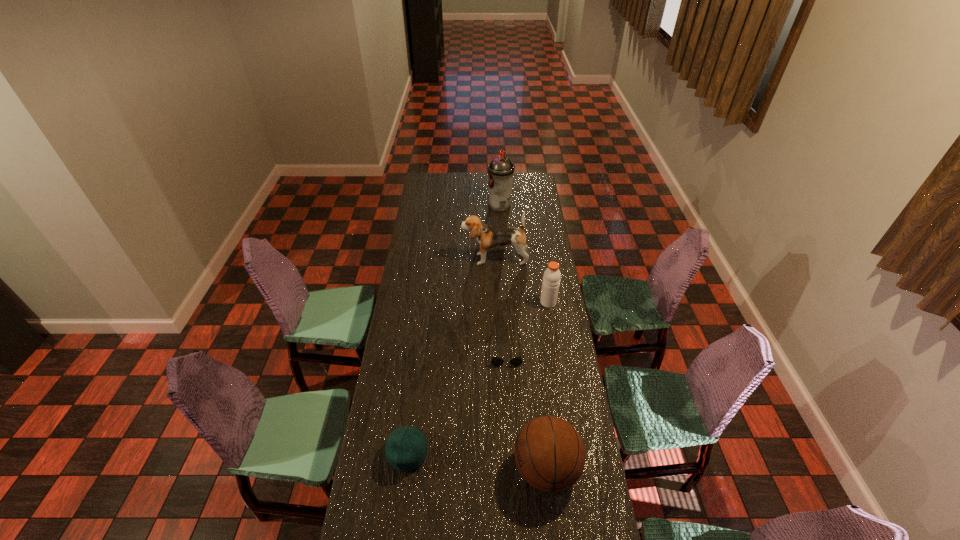
Image resolution: width=960 pixels, height=540 pixels. What are the coordinates of `vacant point located 0.380m on the front of the tallest object` in the screenshot? It's located at (503, 255).

You are a GUI agent. You are given a task and a screenshot of the screen. Output one action in this format:
    pyautogui.click(x=<x>, y=<y>)
    Task: Click on the vacant area situated 0.240m at the face of the second tallest object
    The width and height of the screenshot is (960, 540).
    Given the screenshot: What is the action you would take?
    pyautogui.click(x=415, y=259)

Where is `free space located at the face of the second tallest object`? This screenshot has width=960, height=540. free space located at the face of the second tallest object is located at coordinates (436, 259).

Where is `vacant space located 0.210m at the face of the second tallest object`? The image size is (960, 540). vacant space located 0.210m at the face of the second tallest object is located at coordinates (420, 259).

Find the location of a particular element. This screenshot has height=540, width=960. vacant space situated on the left of the shaker is located at coordinates (497, 302).

The image size is (960, 540). I want to click on free location located 0.070m on the side with brand label of the basketball, so tap(492, 469).

Image resolution: width=960 pixels, height=540 pixels. Identify the location of vacant space situated 0.360m on the side with brand label of the basketball. (407, 469).

At what (x,y) coordinates should I click in order to perform the action: click on free space located on the side with brand label of the basketball. Please return your answer as a coordinate pair (x, y). This screenshot has height=540, width=960. Looking at the image, I should click on (428, 469).

You are a GUI agent. You are given a task and a screenshot of the screen. Output one action in this format:
    pyautogui.click(x=<x>, y=<y>)
    Task: Click on the vacant region located on the right of the second shortest object
    The height and width of the screenshot is (540, 960).
    Given the screenshot: What is the action you would take?
    pyautogui.click(x=466, y=454)

Find the location of a particular element. This screenshot has width=960, height=540. vacant space located 0.290m on the front-facing side of the sunglasses is located at coordinates (510, 433).